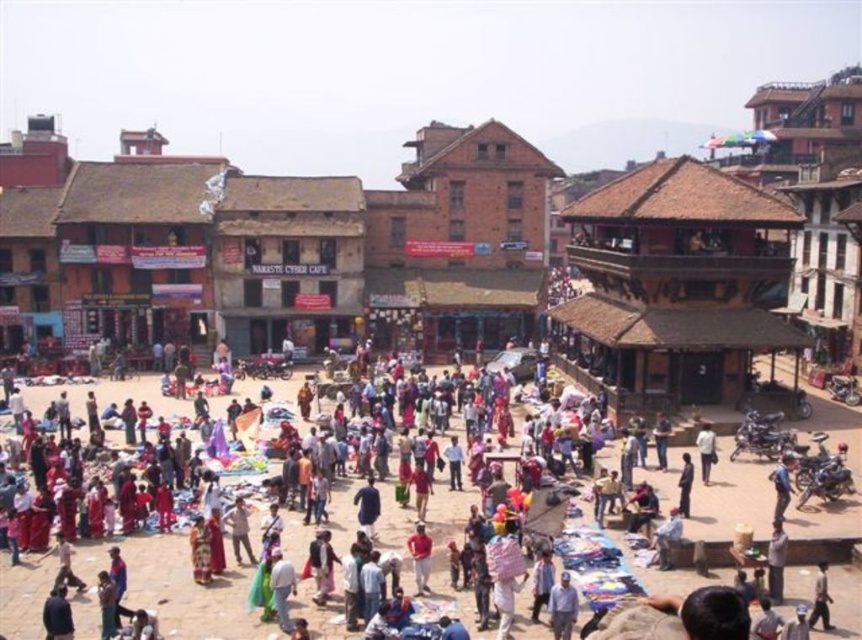
Question: Does matte black motorcycle at center appear under red fabric person at center?

Choices:
 (A) yes
 (B) no

Answer: (B)

Question: Does matte black motorcycle at center lie in front of red fabric person at center?

Choices:
 (A) yes
 (B) no

Answer: (A)

Question: Which of the following is the closest to the observer?

Choices:
 (A) 428,547
 (B) 711,451
 (C) 183,611
 (D) 322,262

Answer: (C)

Question: Among these objects, which one is farthest from the camera?

Choices:
 (A) brown brick building at center
 (B) red fabric person at center
 (C) matte black motorcycle at center
 (D) light brown fabric shirt at center

Answer: (A)

Question: Observing the image, what is the correct spatial positioning of matte black motorcycle at center in reference to light brown fabric shirt at center?

Choices:
 (A) above
 (B) below

Answer: (B)

Question: Considering the real-world distances, which object is farthest from the matte black motorcycle at center?

Choices:
 (A) red fabric person at center
 (B) brown brick building at center
 (C) light brown fabric shirt at center

Answer: (B)